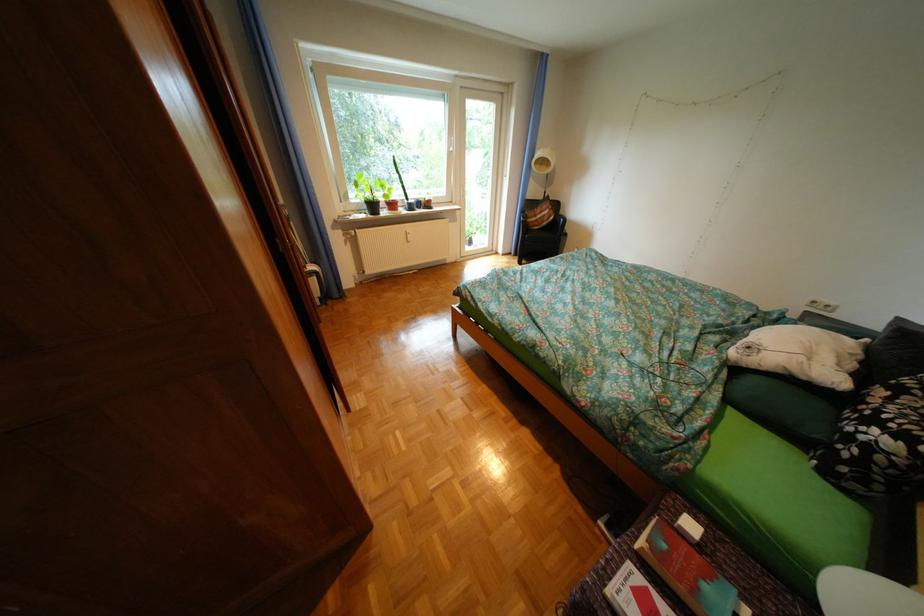
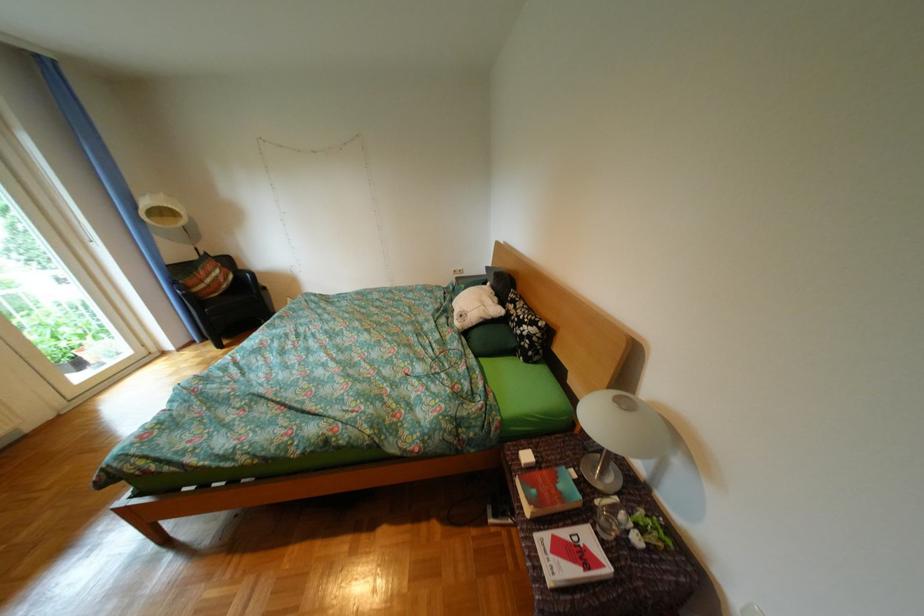
Question: Based on the continuous images, in which direction is the camera rotating? Reply with the corresponding letter.

Choices:
 (A) Left
 (B) Right
 (C) Up
 (D) Down

Answer: (B)